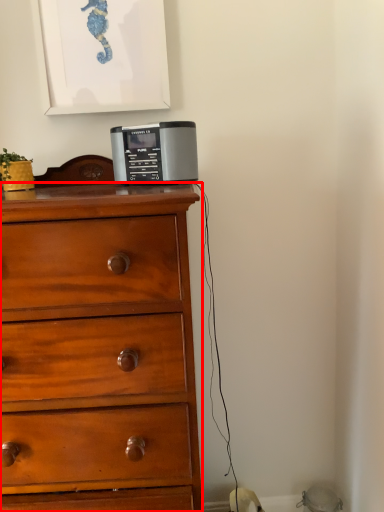
Question: Considering the relative positions of chest of drawers (annotated by the red box) and home appliance in the image provided, where is chest of drawers (annotated by the red box) located with respect to the staircase?

Choices:
 (A) left
 (B) right

Answer: (A)